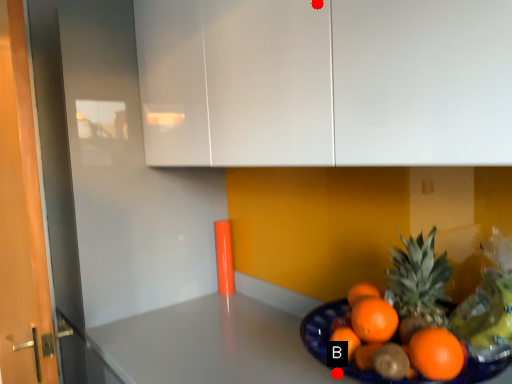
Question: Two points are circled on the image, labeled by A and B beside each circle. Which point appears closest to the camera in this image?

Choices:
 (A) A is closer
 (B) B is closer

Answer: (A)